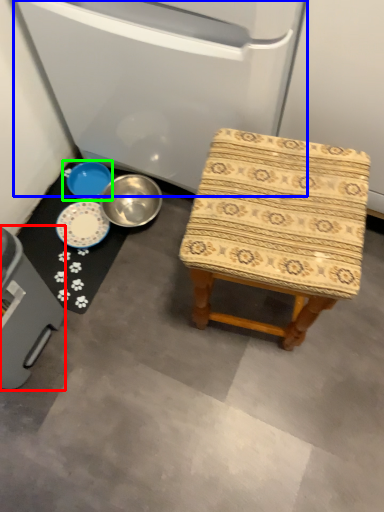
Question: Based on their relative distances, which object is farther from appliance (highlighted by a red box)? Choose from appliance (highlighted by a blue box) and basin (highlighted by a green box).

Choices:
 (A) appliance
 (B) basin

Answer: (A)